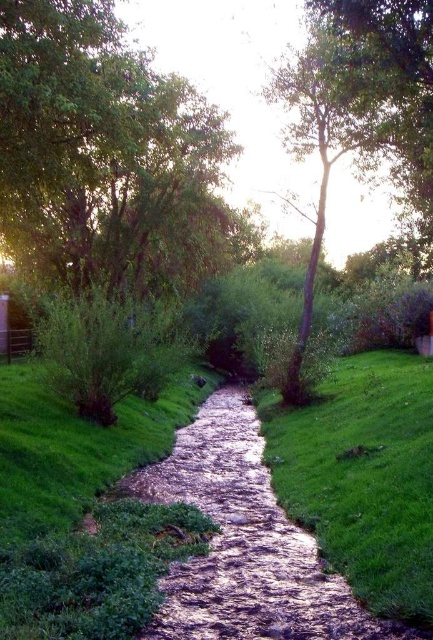
This screenshot has height=640, width=433. In order to click on green grassy bank at center in this screenshot , I will do `click(362, 476)`.

Describe the element at coordinates (362, 476) in the screenshot. I see `green grassy bank at center` at that location.

The width and height of the screenshot is (433, 640). I want to click on green grassy bank at center, so [362, 476].

The width and height of the screenshot is (433, 640). I want to click on green grassy bank at center, so (362, 476).